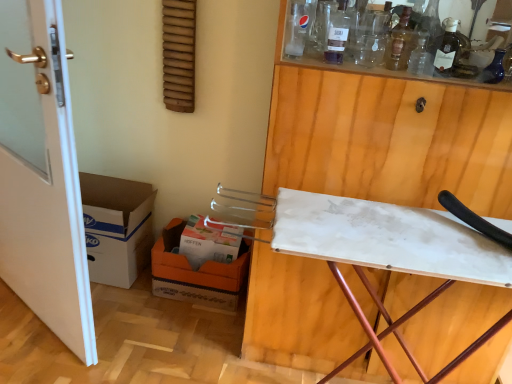
The width and height of the screenshot is (512, 384). Find the location of `spots to the right of white glossy door at left`. spots to the right of white glossy door at left is located at coordinates (163, 329).